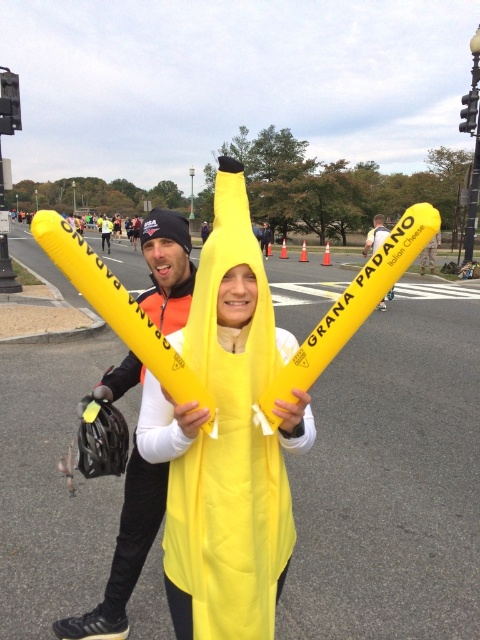
Question: Which object is positioned closest to the yellow fabric banana at center?

Choices:
 (A) yellow matte balloon at center
 (B) matte yellow baton at center

Answer: (B)

Question: From the image, what is the correct spatial relationship of yellow fabric banana at center in relation to matte yellow baton at center?

Choices:
 (A) above
 (B) below

Answer: (B)

Question: Does matte yellow baton at center appear on the left side of yellow matte balloon at center?

Choices:
 (A) no
 (B) yes

Answer: (B)

Question: Which of these objects is positioned closest to the yellow fabric banana at center?

Choices:
 (A) yellow matte balloon at center
 (B) matte yellow baton at center

Answer: (B)

Question: Among these points, which one is farthest from the camera?

Choices:
 (A) (314, 433)
 (B) (192, 268)

Answer: (B)

Question: Is yellow fabric banana at center wider than yellow matte balloon at center?

Choices:
 (A) no
 (B) yes

Answer: (A)